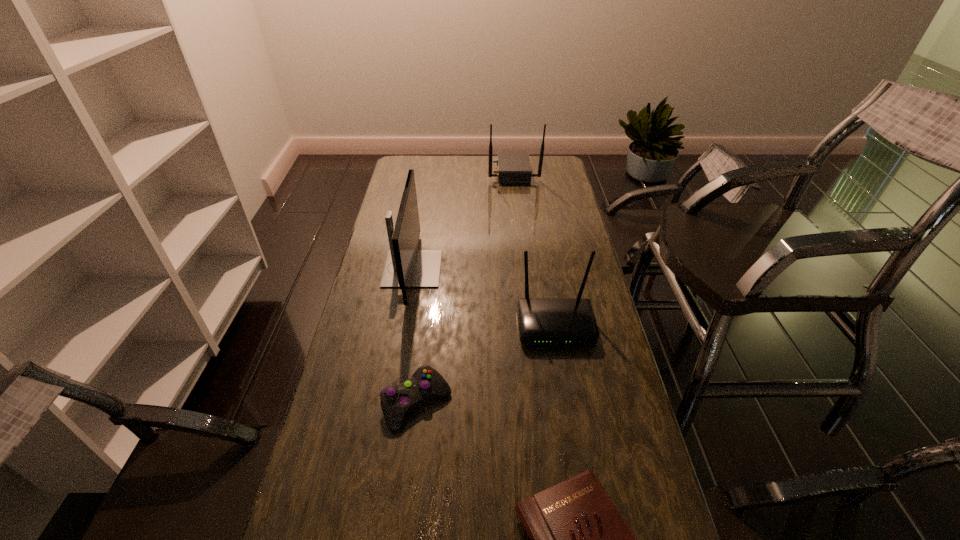
The width and height of the screenshot is (960, 540). Find the location of `free space located on the front-facing side of the third tallest object`. free space located on the front-facing side of the third tallest object is located at coordinates (572, 427).

At what (x,y) coordinates should I click in order to perform the action: click on vacant space located on the right of the control. Please return your answer as a coordinate pair (x, y). The width and height of the screenshot is (960, 540). Looking at the image, I should click on (536, 403).

Where is `object at the far edge`? object at the far edge is located at coordinates (513, 167).

The image size is (960, 540). I want to click on computer monitor at the left edge, so click(405, 267).

You are a GUI agent. You are given a task and a screenshot of the screen. Output one action in this format:
    pyautogui.click(x=<x>, y=<y>)
    Task: Click on the control at the left edge
    
    Given the screenshot: What is the action you would take?
    pyautogui.click(x=396, y=400)

This screenshot has height=540, width=960. I want to click on object present at the far right corner, so click(x=513, y=167).

At what (x,y) coordinates should I click in order to perform the action: click on vacant space at the left edge. Please return your answer as a coordinate pair (x, y). Looking at the image, I should click on pyautogui.click(x=396, y=214).

Locate an element on the screen. This screenshot has width=960, height=540. free space at the right edge is located at coordinates (580, 242).

This screenshot has width=960, height=540. In the image, there is a desktop. Identify the location of vacant area at the far left corner. (414, 166).

At what (x,y) coordinates should I click in order to perform the action: click on free region at the far right corner of the desktop. Please return your answer as a coordinate pair (x, y). Image resolution: width=960 pixels, height=540 pixels. Looking at the image, I should click on (539, 163).